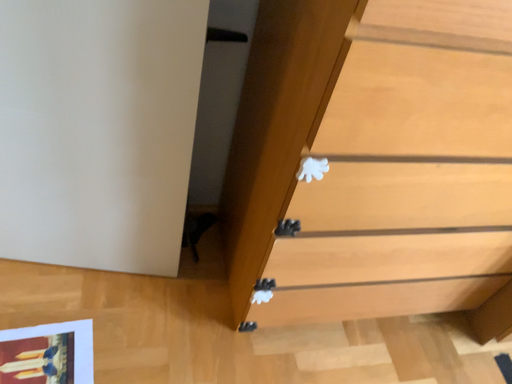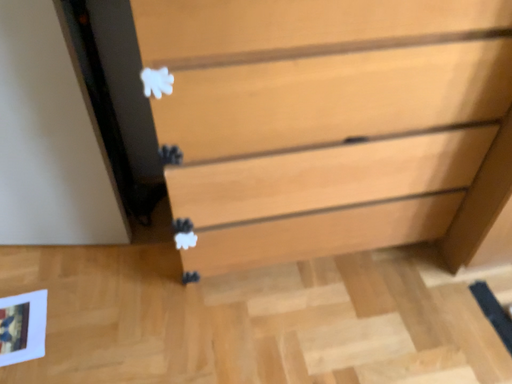
Question: How did the camera likely rotate when shooting the video?

Choices:
 (A) rotated left
 (B) rotated right

Answer: (A)